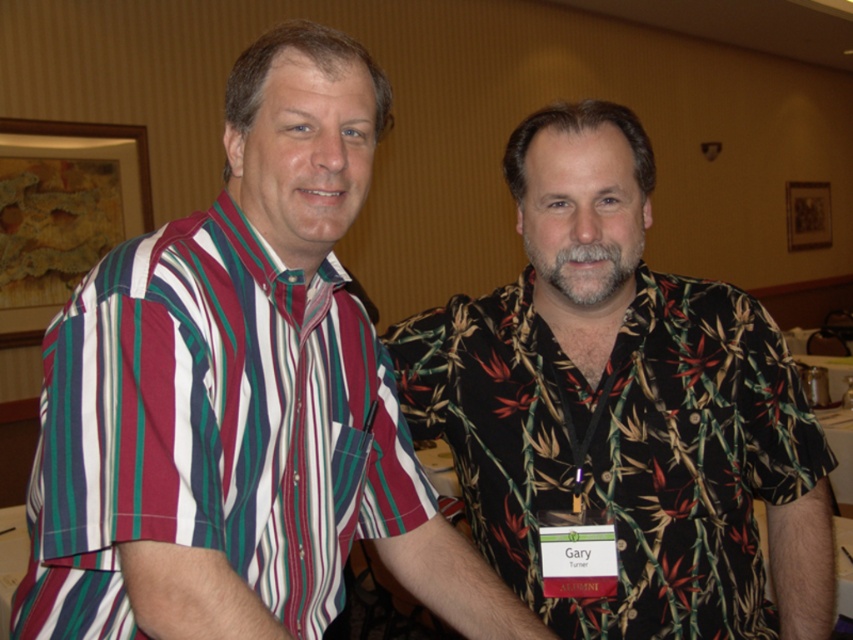
You are standing in the conference room and need to locate the attendee wearing the black floral shirt at right. According to the coordinates provided, where exactly should you look to find this person?

The black floral shirt at right is located at coordinates point (624, 404).

You are organizing a photo shoot and need to position the black floral shirt at right and the striped cotton shirt at left so that they appear balanced in height. Given their current heights, which shirt should you raise or lower to achieve this balance?

The black floral shirt at right is much taller than the striped cotton shirt at left, so you should lower the black floral shirt at right to match the height of the striped cotton shirt at left for balance.